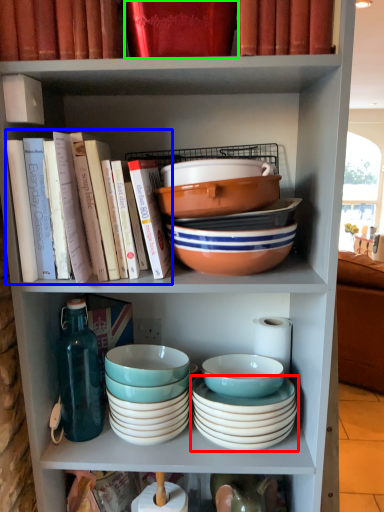
Question: Estimate the real-world distances between objects in this image. Which object is closer to bowl (highlighted by a red box), book (highlighted by a blue box) or book (highlighted by a green box)?

Choices:
 (A) book
 (B) book

Answer: (A)